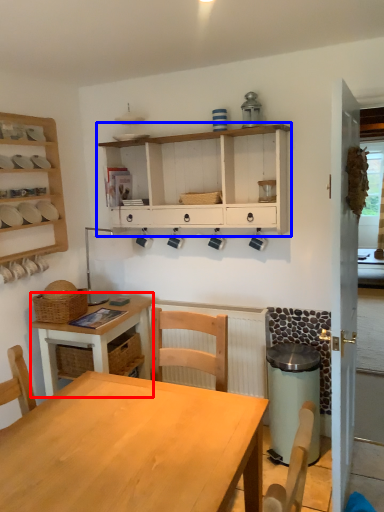
Question: Which point is further to the camera, desk (highlighted by a red box) or shelf (highlighted by a blue box)?

Choices:
 (A) desk
 (B) shelf

Answer: (A)